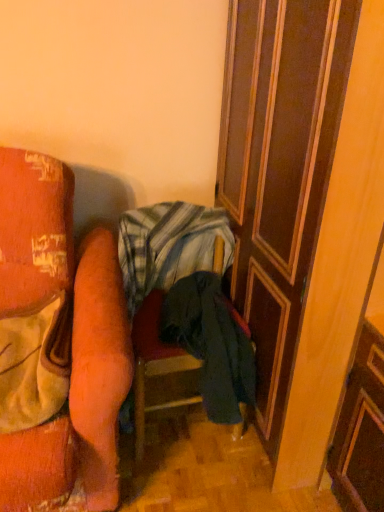
What do you see at coordinates (279, 168) in the screenshot? I see `wooden at right` at bounding box center [279, 168].

Locate an element on the screen. The width and height of the screenshot is (384, 512). wooden at right is located at coordinates (279, 168).

Identify the location of dark blue fabric chair at center. (152, 361).

Where is `wooden at right`? wooden at right is located at coordinates (279, 168).

Measure the distance from striped cotton blanket at center to dark blue fabric chair at center.

striped cotton blanket at center and dark blue fabric chair at center are 8.94 inches apart.

I want to click on blanket on the left side of dark blue fabric chair at center, so click(x=168, y=246).

Can you see striped cotton blanket at center touching dark blue fabric chair at center?

No, striped cotton blanket at center is not beside dark blue fabric chair at center.

Would you say striped cotton blanket at center contains dark blue fabric chair at center?

Yes, dark blue fabric chair at center is inside striped cotton blanket at center.

From the image's perspective, is dark blue fabric chair at center on top of wooden at right?

No.

Considering the sizes of dark blue fabric chair at center and wooden at right in the image, is dark blue fabric chair at center taller or shorter than wooden at right?

Clearly, dark blue fabric chair at center is shorter compared to wooden at right.

Between point (155, 303) and point (296, 164), which one is positioned behind?

Positioned behind is point (155, 303).

Which object is thinner, striped cotton blanket at center or wooden at right?

With smaller width is striped cotton blanket at center.

Is striped cotton blanket at center next to wooden at right?

No, striped cotton blanket at center is not beside wooden at right.

Do you think striped cotton blanket at center is within wooden at right, or outside of it?

striped cotton blanket at center exists outside the volume of wooden at right.

This screenshot has height=512, width=384. I want to click on blanket located above the dark blue fabric chair at center (from a real-world perspective), so click(x=168, y=246).

What's the angular difference between dark blue fabric chair at center and striped cotton blanket at center's facing directions?

The angular difference between dark blue fabric chair at center and striped cotton blanket at center is 0.778 degrees.

From a real-world perspective, is dark blue fabric chair at center above or below striped cotton blanket at center?

In terms of real-world spatial position, dark blue fabric chair at center is below striped cotton blanket at center.

Can you confirm if wooden at right is positioned to the right of striped cotton blanket at center?

Indeed, wooden at right is positioned on the right side of striped cotton blanket at center.

Looking at this image, is wooden at right bigger than striped cotton blanket at center?

Indeed, wooden at right has a larger size compared to striped cotton blanket at center.

From a real-world perspective, is wooden at right over striped cotton blanket at center?

Yes.

Does wooden at right lie in front of dark blue fabric chair at center?

Yes, it is in front of dark blue fabric chair at center.

Does point (274, 66) come farther from viewer compared to point (156, 353)?

No, it is not.

From a real-world perspective, who is located higher, wooden at right or dark blue fabric chair at center?

wooden at right, from a real-world perspective.

Identify the location of furniture below the striped cotton blanket at center (from a real-world perspective). (152, 361).

At what (x,y) coordinates should I click in order to perform the action: click on furniture on the left of the wooden at right. Please return your answer as a coordinate pair (x, y). This screenshot has width=384, height=512. Looking at the image, I should click on (152, 361).

When comparing their distances from dark blue fabric chair at center, does wooden at right or striped cotton blanket at center seem further?

The object further to dark blue fabric chair at center is wooden at right.

When comparing their distances from striped cotton blanket at center, does dark blue fabric chair at center or wooden at right seem closer?

dark blue fabric chair at center lies closer to striped cotton blanket at center than the other object.

Which object lies nearer to the anchor point wooden at right, striped cotton blanket at center or dark blue fabric chair at center?

striped cotton blanket at center lies closer to wooden at right than the other object.

Looking at the image, which one is located further to wooden at right, dark blue fabric chair at center or striped cotton blanket at center?

dark blue fabric chair at center.

Considering their positions, is striped cotton blanket at center positioned closer to dark blue fabric chair at center than wooden at right?

Based on the image, striped cotton blanket at center appears to be nearer to dark blue fabric chair at center.

Considering their positions, is wooden at right positioned further to striped cotton blanket at center than dark blue fabric chair at center?

wooden at right is positioned further to the anchor striped cotton blanket at center.

This screenshot has width=384, height=512. Find the location of `furniture between striped cotton blanket at center and wooden at right`. furniture between striped cotton blanket at center and wooden at right is located at coordinates (152, 361).